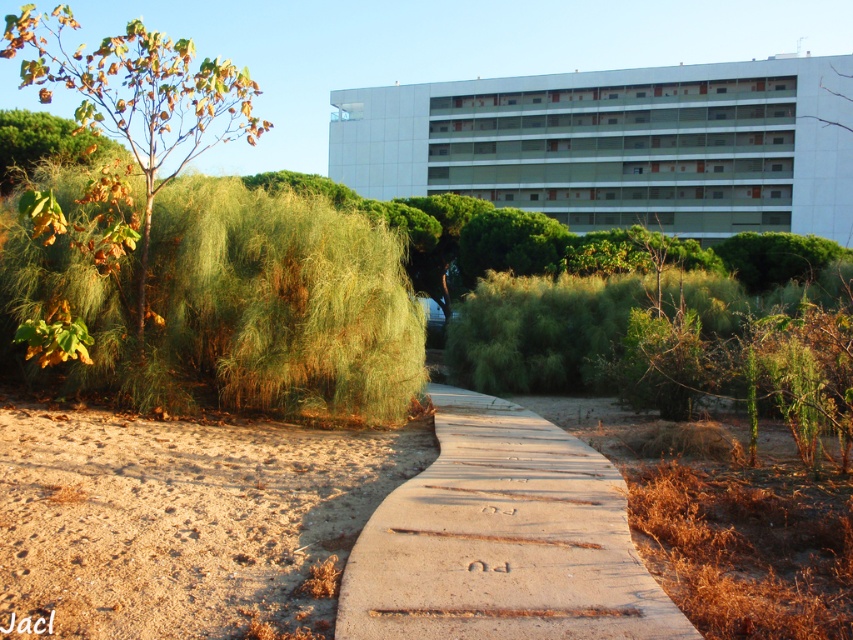
Question: Which object appears closest to the camera in this image?

Choices:
 (A) brown leafy tree at left
 (B) brown concrete pavement at center
 (C) white smooth building at upper center

Answer: (B)

Question: Which point is farther from the camera taking this photo?

Choices:
 (A) (186, 276)
 (B) (722, 64)
 (C) (3, 536)

Answer: (B)

Question: Observing the image, what is the correct spatial positioning of brown concrete pavement at center in reference to wooden at center?

Choices:
 (A) left
 (B) right

Answer: (A)

Question: Among these objects, which one is nearest to the camera?

Choices:
 (A) brown leafy tree at left
 (B) white smooth building at upper center
 (C) brown concrete pavement at center

Answer: (C)

Question: Is green grassy hedge at left to the right of brown concrete pavement at center from the viewer's perspective?

Choices:
 (A) no
 (B) yes

Answer: (B)

Question: Can you confirm if brown concrete pavement at center is thinner than brown leafy tree at left?

Choices:
 (A) yes
 (B) no

Answer: (A)